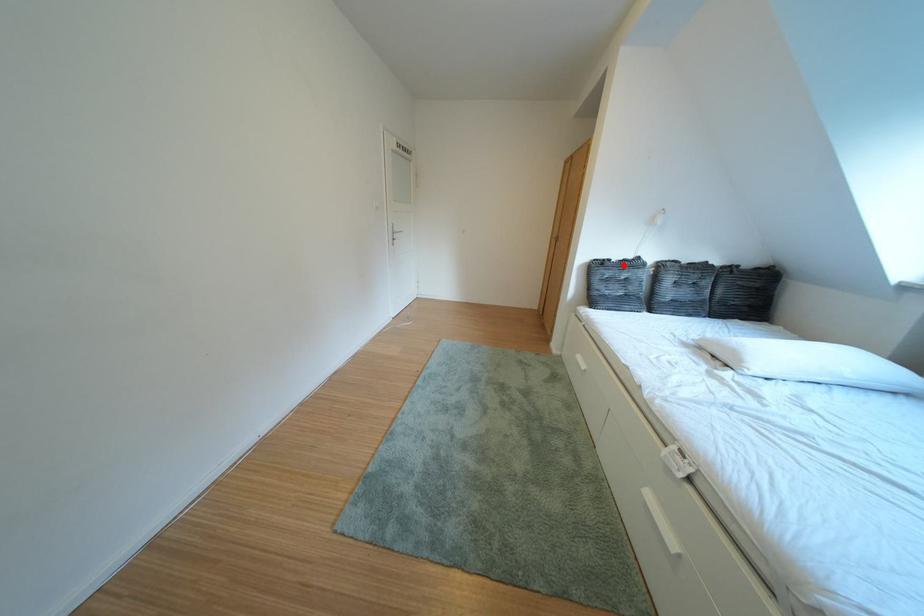
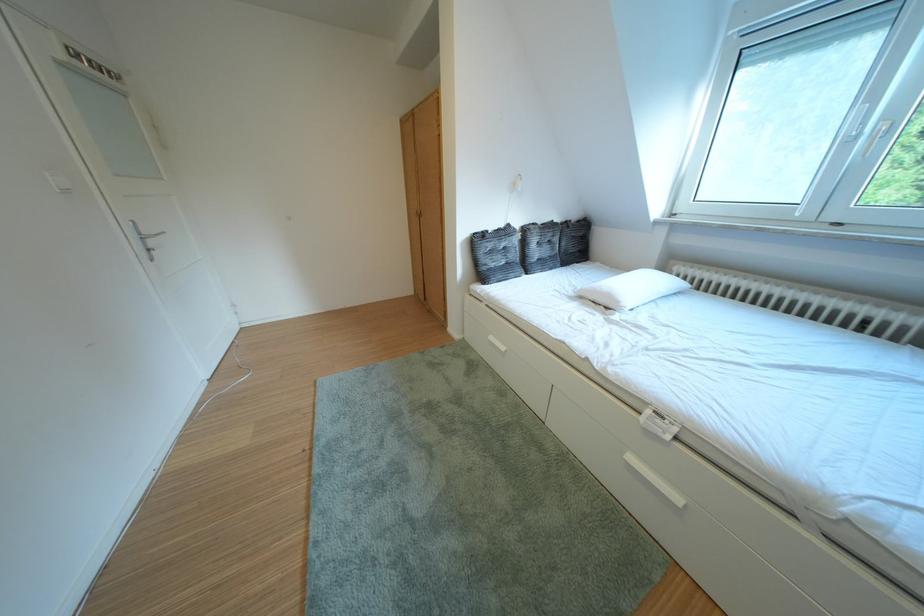
Question: I am providing you with two images of the same scene from different viewpoints. Given a red point in image1, look at the same physical point in image2. Is it:

Choices:
 (A) Closer to the viewpoint
 (B) Farther from the viewpoint

Answer: (A)